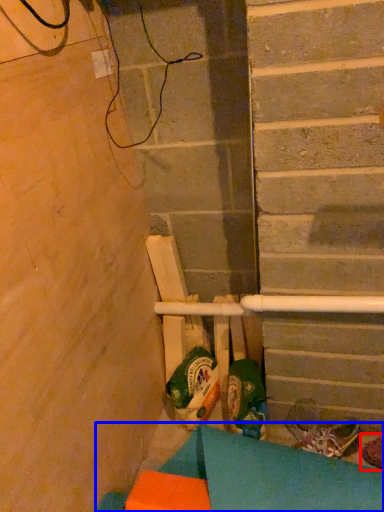
Question: Which object is closer to the camera taking this photo, footwear (highlighted by a red box) or furniture (highlighted by a blue box)?

Choices:
 (A) footwear
 (B) furniture

Answer: (B)